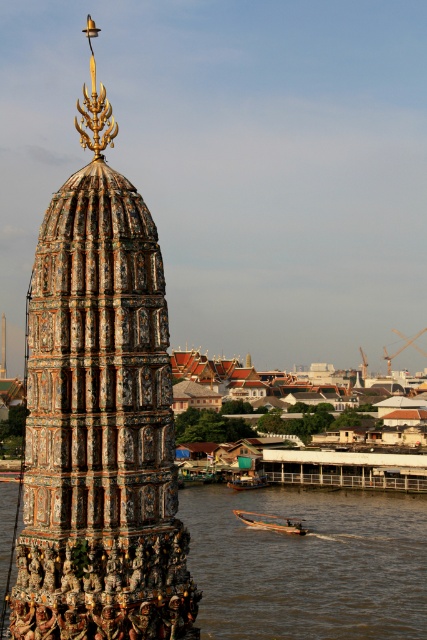
Does brown water at lower center appear over wooden boat at lower center?

Actually, brown water at lower center is below wooden boat at lower center.

Is brown water at lower center bigger than wooden boat at lower center?

Correct, brown water at lower center is larger in size than wooden boat at lower center.

Find the location of a particular element. Image resolution: width=427 pixels, height=640 pixels. brown water at lower center is located at coordinates (307, 563).

Does point (295, 605) come in front of point (230, 481)?

Yes.

Which is behind, point (193, 545) or point (260, 480)?

The point (260, 480) is more distant.

You are a GUI agent. You are given a task and a screenshot of the screen. Output one action in this format:
    pyautogui.click(x=<x>, y=<y>)
    Task: Click on the brown water at lower center
    Image resolution: width=427 pixels, height=640 pixels.
    Given the screenshot: What is the action you would take?
    pyautogui.click(x=307, y=563)

Based on the photo, which of these two, multicolored mosaic tower at center or wooden boat at lower center, stands taller?

multicolored mosaic tower at center is taller.

Who is more distant from viewer, (101, 304) or (249, 522)?

The point (249, 522) is more distant.

The height and width of the screenshot is (640, 427). I want to click on multicolored mosaic tower at center, so click(99, 419).